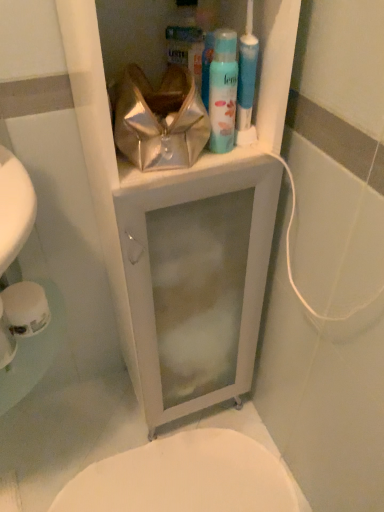
Question: Could white glossy medicine cabinet at upper center be considered to be inside light blue matte shaving cream at upper center?

Choices:
 (A) no
 (B) yes

Answer: (A)

Question: From a real-world perspective, is light blue matte shaving cream at upper center below white glossy medicine cabinet at upper center?

Choices:
 (A) no
 (B) yes

Answer: (A)

Question: Is white glossy medicine cabinet at upper center at the back of light blue matte shaving cream at upper center?

Choices:
 (A) yes
 (B) no

Answer: (A)

Question: Considering the relative sizes of light blue matte shaving cream at upper center and white glossy medicine cabinet at upper center in the image provided, is light blue matte shaving cream at upper center smaller than white glossy medicine cabinet at upper center?

Choices:
 (A) yes
 (B) no

Answer: (A)

Question: Does light blue matte shaving cream at upper center turn towards white glossy medicine cabinet at upper center?

Choices:
 (A) yes
 (B) no

Answer: (A)

Question: In terms of height, does light blue matte shaving cream at upper center look taller or shorter compared to white glossy medicine cabinet at upper center?

Choices:
 (A) short
 (B) tall

Answer: (A)

Question: Is point (225, 32) closer or farther from the camera than point (97, 87)?

Choices:
 (A) closer
 (B) farther

Answer: (B)

Question: Looking at the image, does light blue matte shaving cream at upper center seem bigger or smaller compared to white glossy medicine cabinet at upper center?

Choices:
 (A) big
 (B) small

Answer: (B)

Question: Considering the positions of light blue matte shaving cream at upper center and white glossy medicine cabinet at upper center in the image, is light blue matte shaving cream at upper center wider or thinner than white glossy medicine cabinet at upper center?

Choices:
 (A) thin
 (B) wide

Answer: (A)

Question: In terms of size, does white glossy bidet at lower center appear bigger or smaller than white matte toilet paper at lower left?

Choices:
 (A) small
 (B) big

Answer: (B)

Question: Is white glossy bidet at lower center wider or thinner than white matte toilet paper at lower left?

Choices:
 (A) thin
 (B) wide

Answer: (B)

Question: Considering the relative positions of white glossy bidet at lower center and white matte toilet paper at lower left in the image provided, is white glossy bidet at lower center to the left or to the right of white matte toilet paper at lower left?

Choices:
 (A) left
 (B) right

Answer: (B)

Question: From the image's perspective, is white glossy bidet at lower center above or below white matte toilet paper at lower left?

Choices:
 (A) above
 (B) below

Answer: (B)

Question: From the image's perspective, is metallic gold pouch at upper center above or below light blue matte shaving cream at upper center?

Choices:
 (A) below
 (B) above

Answer: (A)

Question: In the image, is metallic gold pouch at upper center positioned in front of or behind light blue matte shaving cream at upper center?

Choices:
 (A) front
 (B) behind

Answer: (A)